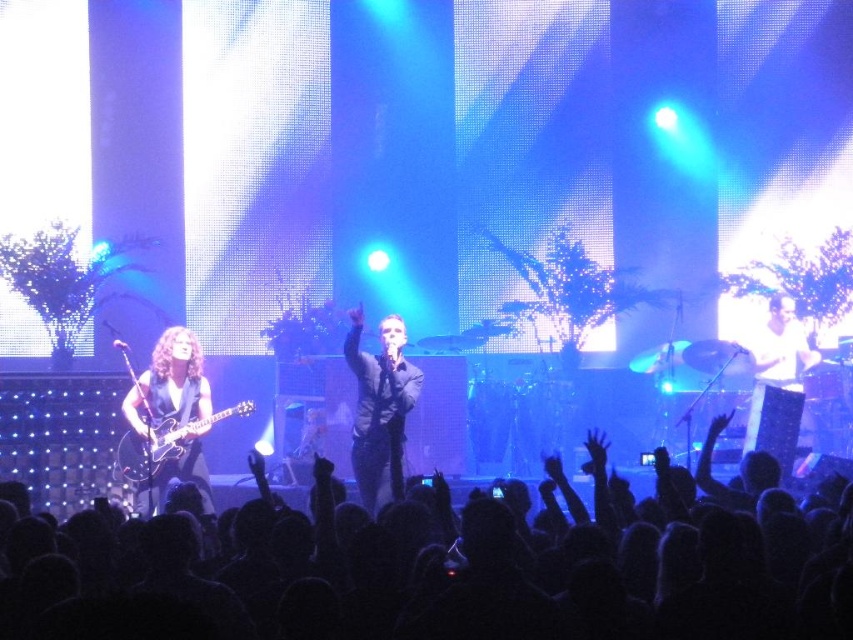
Question: Can you confirm if black fabric crowd at center is wider than black matte suit at center?

Choices:
 (A) no
 (B) yes

Answer: (B)

Question: Does shiny black guitar at left have a lesser width compared to glossy black guitar at left?

Choices:
 (A) yes
 (B) no

Answer: (A)

Question: Where is black fabric crowd at center located in relation to shiny black guitar at left in the image?

Choices:
 (A) above
 (B) below

Answer: (B)

Question: Which of the following is the closest to the observer?

Choices:
 (A) (831, 572)
 (B) (160, 376)
 (C) (155, 467)
 (D) (387, 326)

Answer: (A)

Question: Among these points, which one is nearest to the camera?

Choices:
 (A) (173, 502)
 (B) (122, 465)
 (C) (367, 506)
 (D) (190, 392)

Answer: (A)

Question: Among these objects, which one is farthest from the camera?

Choices:
 (A) black matte suit at center
 (B) glossy black guitar at left

Answer: (B)